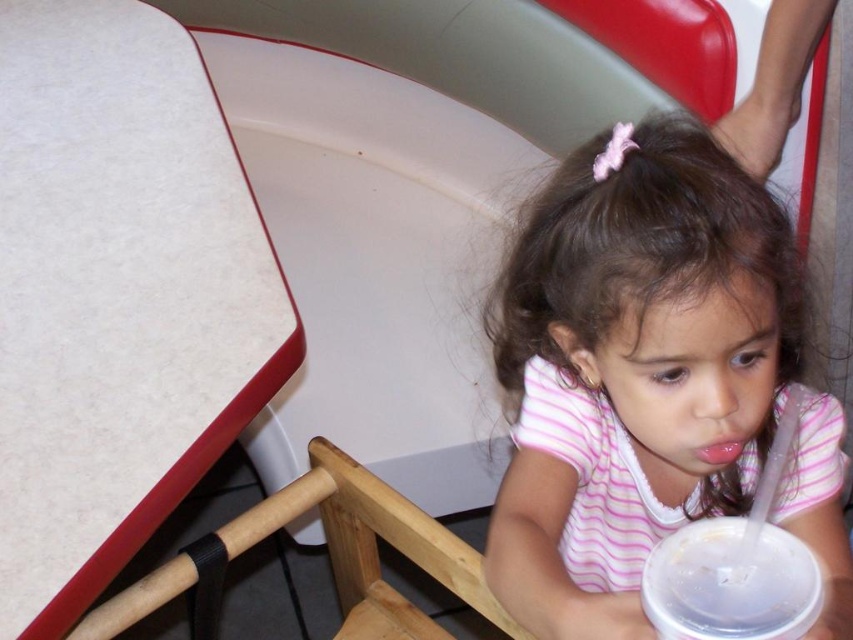
Question: Among these points, which one is farthest from the camera?

Choices:
 (A) (387, 524)
 (B) (289, 364)
 (C) (683, 580)

Answer: (A)

Question: Is white laminate table at upper left to the left of clear plastic cup at lower right from the viewer's perspective?

Choices:
 (A) no
 (B) yes

Answer: (B)

Question: Which object is closer to the camera taking this photo?

Choices:
 (A) white laminate table at upper left
 (B) clear plastic cup at lower right
 (C) wooden chair at lower center

Answer: (B)

Question: Which point is closer to the camera?

Choices:
 (A) (142, 604)
 (B) (694, 618)
 (C) (39, 433)

Answer: (B)

Question: Is white laminate table at upper left positioned before wooden chair at lower center?

Choices:
 (A) yes
 (B) no

Answer: (A)

Question: Does wooden chair at lower center have a greater width compared to clear plastic cup at lower right?

Choices:
 (A) yes
 (B) no

Answer: (A)